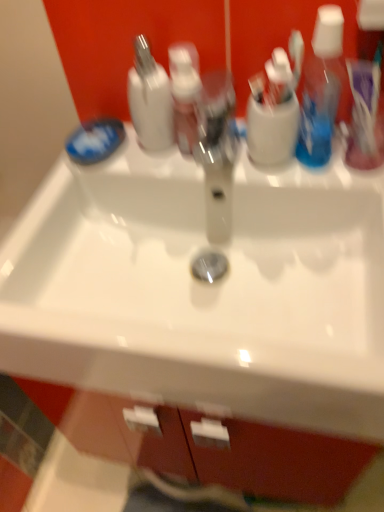
The image size is (384, 512). Identify the location of vacant space in front of blue matte soap at left. (66, 190).